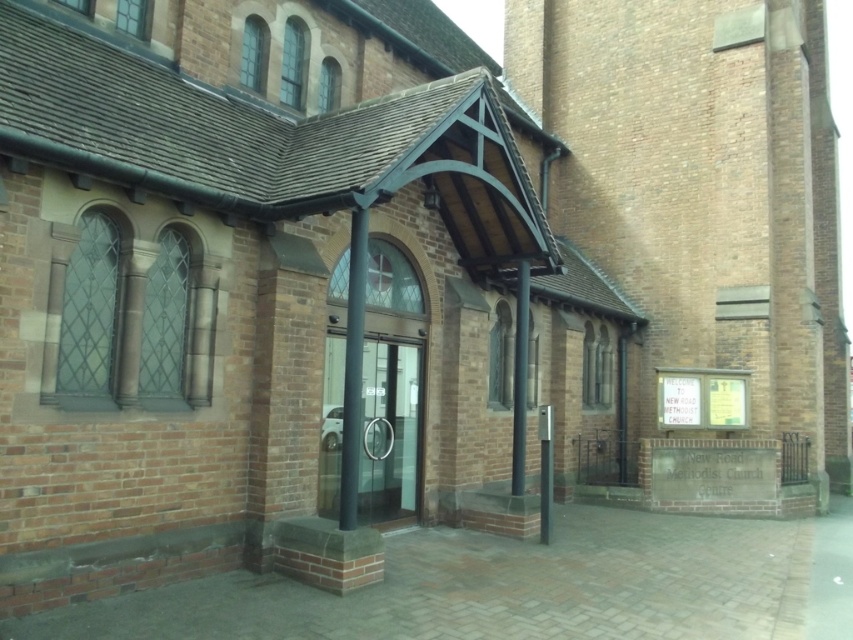
Question: Can you confirm if black smooth pole at center is positioned to the left of metallic pole at center?

Choices:
 (A) yes
 (B) no

Answer: (A)

Question: Does black smooth pole at center appear under metallic pole at center?

Choices:
 (A) yes
 (B) no

Answer: (B)

Question: Which object appears closest to the camera in this image?

Choices:
 (A) metallic pole at center
 (B) clear glass door at center

Answer: (B)

Question: Which of the following is the farthest from the observer?

Choices:
 (A) (340, 502)
 (B) (520, 269)

Answer: (B)

Question: Does clear glass door at center appear under metallic pole at center?

Choices:
 (A) yes
 (B) no

Answer: (A)

Question: Which object is the closest to the clear glass door at center?

Choices:
 (A) black smooth pole at center
 (B) metallic pole at center

Answer: (B)